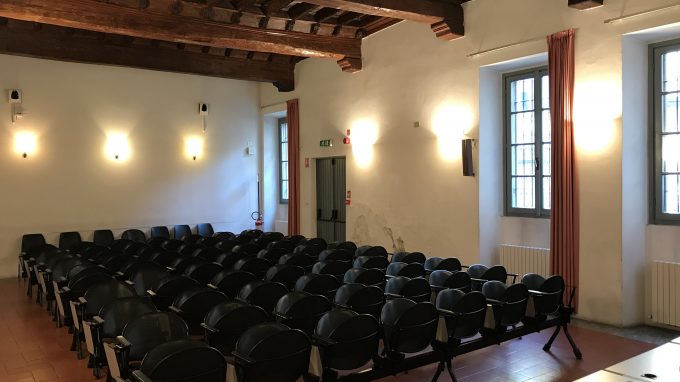
This screenshot has width=680, height=382. What are the coordinates of `beams` in the screenshot? It's located at (167, 60).